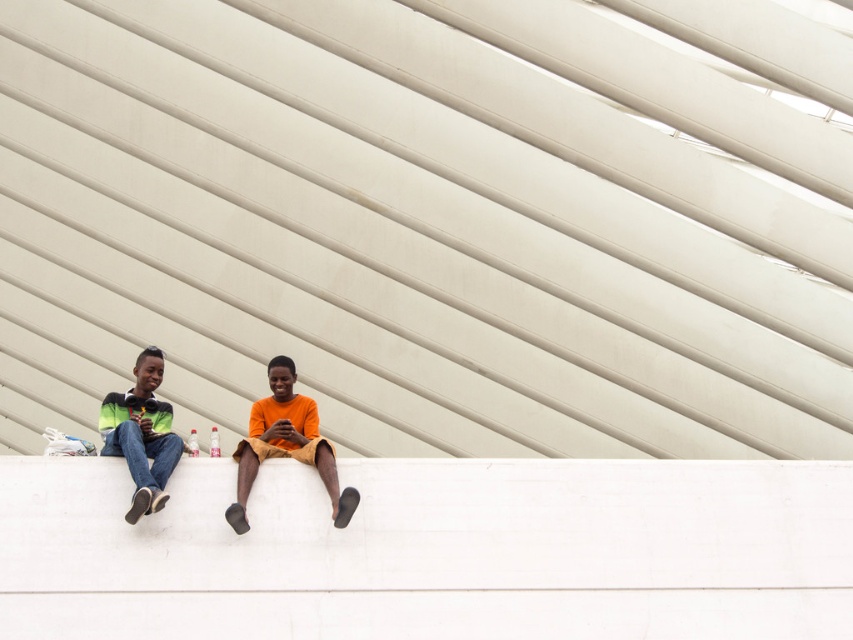
Please describe the location of the orange matte shirt at center in terms of coordinates within the image frame. The image frame is divided into a grid with coordinates ranging from 0 to 1 on both the x and y axes. The origin point is at the bottom left corner of the image. You must use the exact object label provided in the question.

The orange matte shirt at center is located at coordinates point 0.695 on the x axis and 0.336 on the y axis within the image frame.